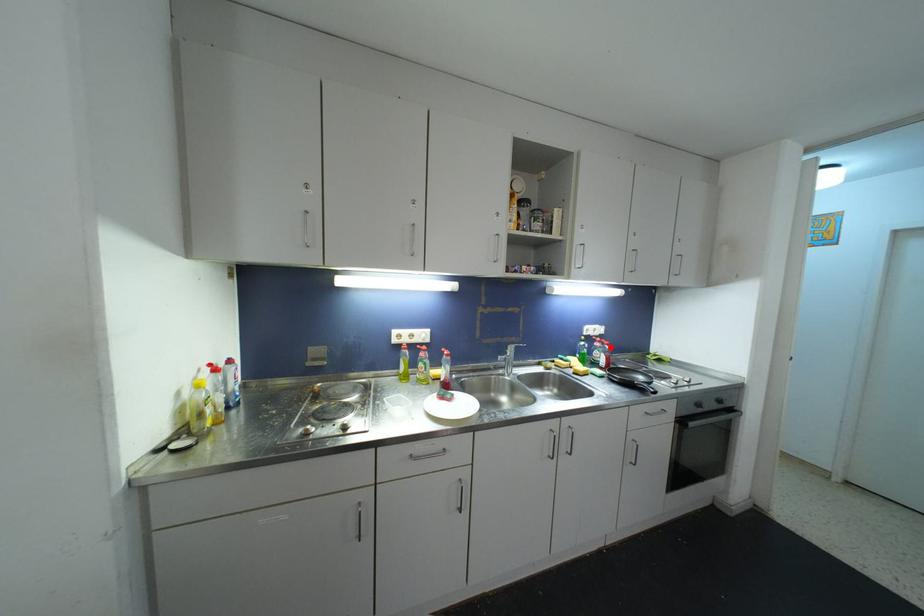
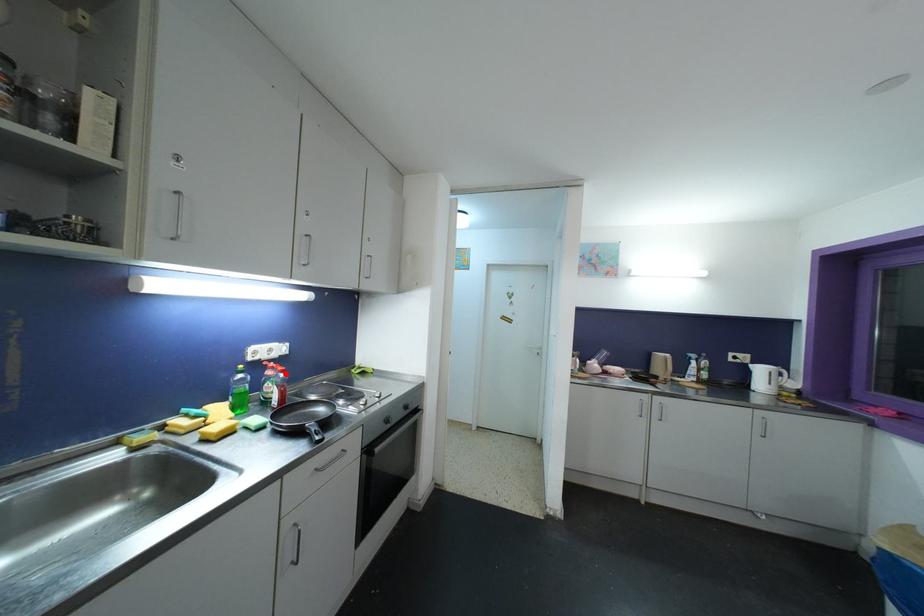
I am providing you with two images of the same scene from different viewpoints. A red point is marked on the first image and another point is marked on the second image. Is the marked point in image1 the same physical position as the marked point in image2?

Yes